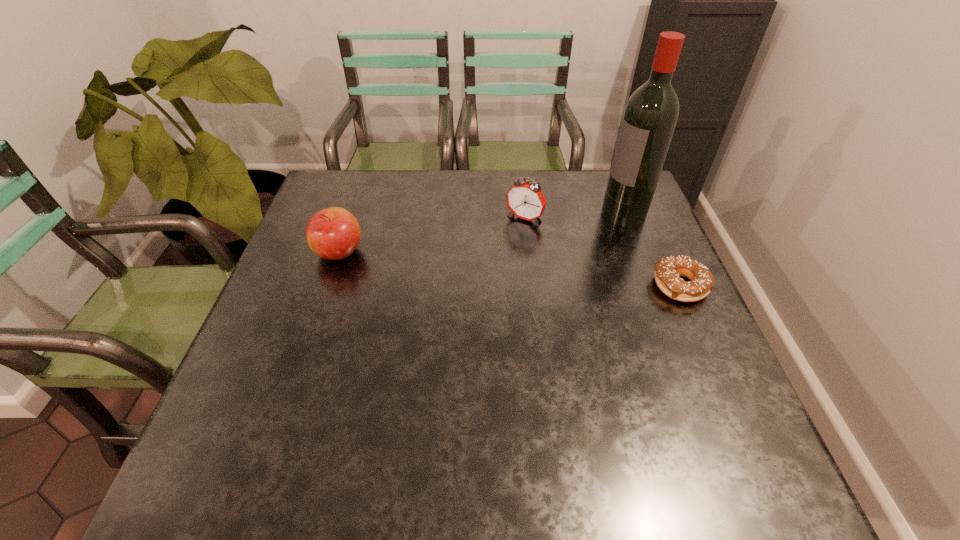
The image size is (960, 540). Find the location of `free point between the apple and the alarm clock`. free point between the apple and the alarm clock is located at coordinates tap(432, 235).

Where is `empty space that is in between the leftmost object and the shortest object`? empty space that is in between the leftmost object and the shortest object is located at coordinates (510, 269).

I want to click on unoccupied position between the doughnut and the alarm clock, so click(602, 252).

The width and height of the screenshot is (960, 540). In order to click on object that stands as the closest to the doughnut in this screenshot , I will do pos(649,120).

Identify which object is the third nearest to the leftmost object. Please provide its 2D coordinates. Your answer should be formatted as a tuple, i.e. [(x, y)], where the tuple contains the x and y coordinates of a point satisfying the conditions above.

[(668, 270)]

At what (x,y) coordinates should I click in order to perform the action: click on vacant space that satisfies the following two spatial constraints: 1. on the front side of the shortest object; 2. on the right side of the wine bottle. Please return your answer as a coordinate pair (x, y). This screenshot has width=960, height=540. Looking at the image, I should click on (651, 286).